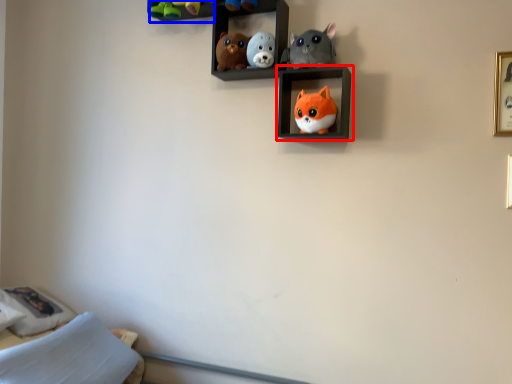
Question: Which point is further to the camera, shelf (highlighted by a red box) or cabinet (highlighted by a blue box)?

Choices:
 (A) shelf
 (B) cabinet

Answer: (B)